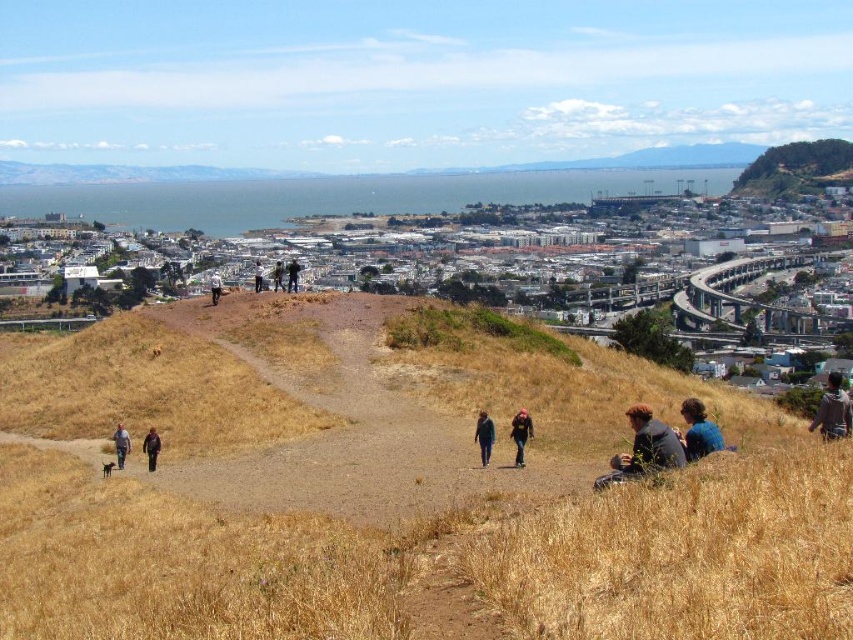
Is brown textured jacket at lower right taller than black fabric jacket at center?

Indeed, brown textured jacket at lower right has a greater height compared to black fabric jacket at center.

Who is positioned more to the left, brown textured jacket at lower right or black fabric jacket at center?

Positioned to the left is black fabric jacket at center.

Is point (833, 378) positioned before point (515, 429)?

That is False.

What are the coordinates of `brown textured jacket at lower right` in the screenshot? It's located at (833, 410).

Between point (134, 320) and point (515, 433), which one is positioned in front?

Point (515, 433) is more forward.

Is point (64, 604) in front of point (525, 419)?

Yes, it is in front of point (525, 419).

Is point (199, 413) more distant than point (531, 417)?

Yes.

Locate an element on the screen. This screenshot has height=640, width=853. dry grass at center is located at coordinates (392, 490).

In the scene shown: How much distance is there between dark brown leather jacket at lower left and dark blue jeans at center?

The distance of dark brown leather jacket at lower left from dark blue jeans at center is 144.03 meters.

Is point (149, 429) closer to camera compared to point (289, 291)?

Yes, point (149, 429) is closer to viewer.

The height and width of the screenshot is (640, 853). I want to click on dark brown leather jacket at lower left, so click(x=151, y=448).